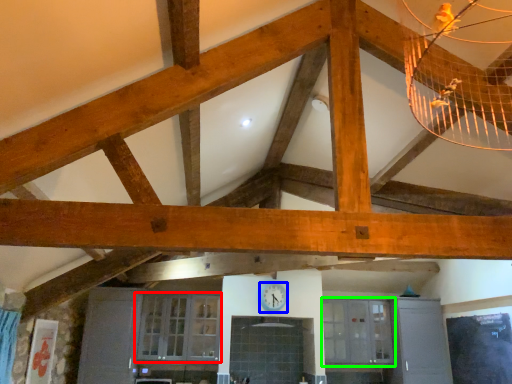
Question: Based on their relative distances, which object is farther from window (highlighted by a red box)? Choose from clock (highlighted by a blue box) and window (highlighted by a green box).

Choices:
 (A) clock
 (B) window

Answer: (B)